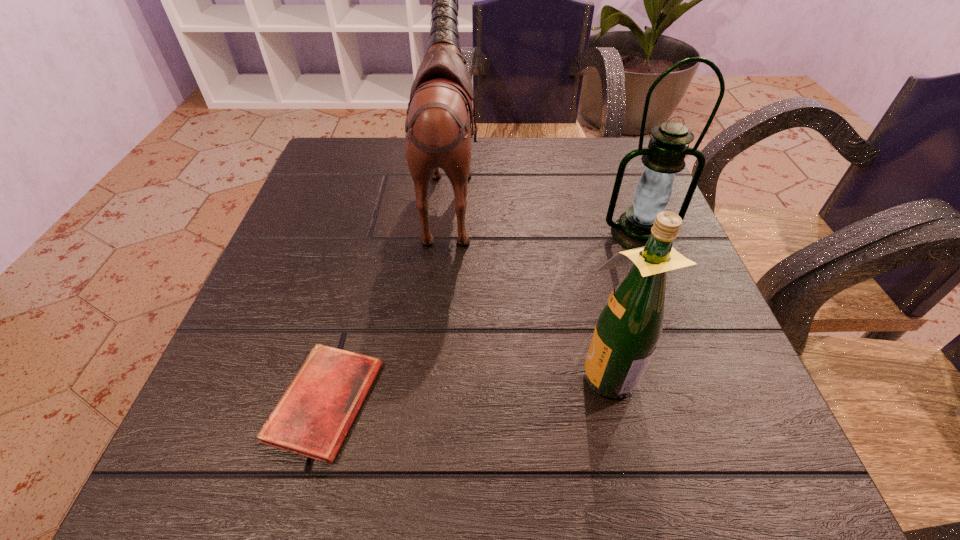
Locate an element on the screen. The height and width of the screenshot is (540, 960). the second object from left to right is located at coordinates (437, 129).

Find the location of a particular element. the rightmost object is located at coordinates (669, 145).

At what (x,y) coordinates should I click in order to perform the action: click on liquor. Please return your answer as a coordinate pair (x, y). The height and width of the screenshot is (540, 960). Looking at the image, I should click on (630, 324).

The image size is (960, 540). I want to click on the leftmost object, so click(312, 418).

Where is `diary`? diary is located at coordinates point(312,418).

Locate an element on the screen. The width and height of the screenshot is (960, 540). free location located on the back of the saddle is located at coordinates (610, 191).

The height and width of the screenshot is (540, 960). In order to click on vacant space located on the side where the rightmost object emits light in this screenshot , I will do (x=676, y=329).

Where is `free point located on the front-facing side of the second object from right to left`? Image resolution: width=960 pixels, height=540 pixels. free point located on the front-facing side of the second object from right to left is located at coordinates (354, 372).

Locate an element on the screen. free region located 0.130m on the front-facing side of the second object from right to left is located at coordinates (489, 372).

I want to click on vacant area located on the front-facing side of the second object from right to left, so click(455, 372).